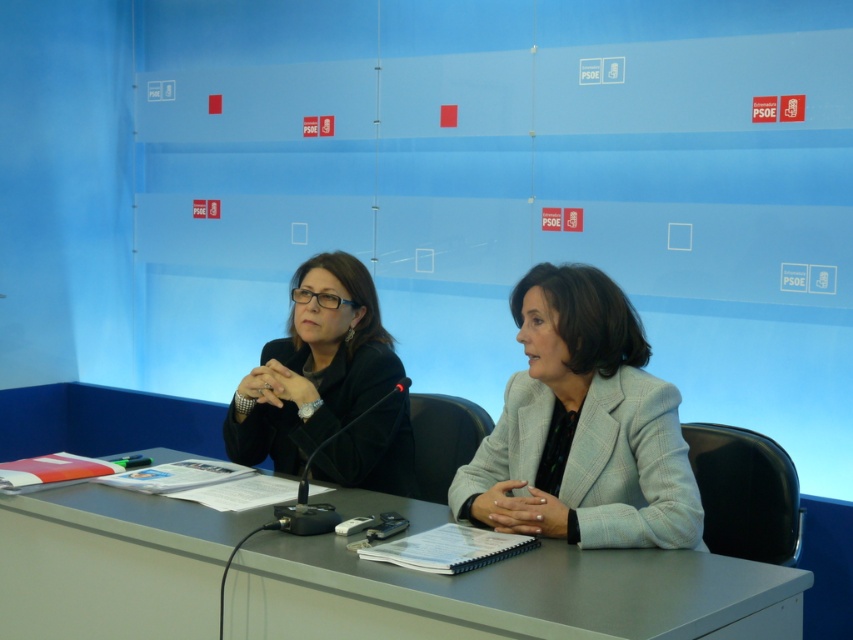
Question: Which of the following is the farthest from the observer?

Choices:
 (A) light gray textured blazer at center
 (B) gray matte table at center

Answer: (A)

Question: Does gray matte table at center come in front of black matte jacket at center?

Choices:
 (A) no
 (B) yes

Answer: (B)

Question: Estimate the real-world distances between objects in this image. Which object is closer to the black matte jacket at center?

Choices:
 (A) gray matte table at center
 (B) light gray textured blazer at center

Answer: (A)

Question: Which object is the farthest from the light gray textured blazer at center?

Choices:
 (A) gray matte table at center
 (B) black matte jacket at center

Answer: (B)

Question: Where is light gray textured blazer at center located in relation to black matte jacket at center in the image?

Choices:
 (A) below
 (B) above

Answer: (A)

Question: Does light gray textured blazer at center have a greater width compared to black matte jacket at center?

Choices:
 (A) yes
 (B) no

Answer: (A)